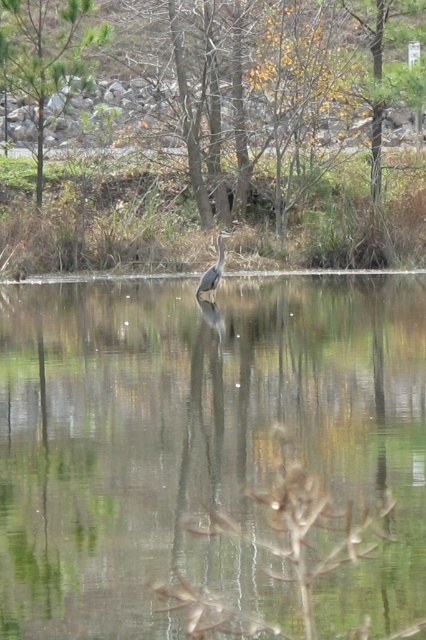
You are an environmental scientist studying the ecosystem of this pond. You notice the clear water at center and the brown textured tree at upper center. Which object is positioned higher in the image?

The brown textured tree at upper center is positioned higher in the image than the clear water at center.

You are an environmental scientist assessing the health of this pond. You notice the clear water at center and the brown textured tree at upper center. Which object in the scene takes up more space?

The clear water at center takes up more space than the brown textured tree at upper center because it is larger in size according to the description.